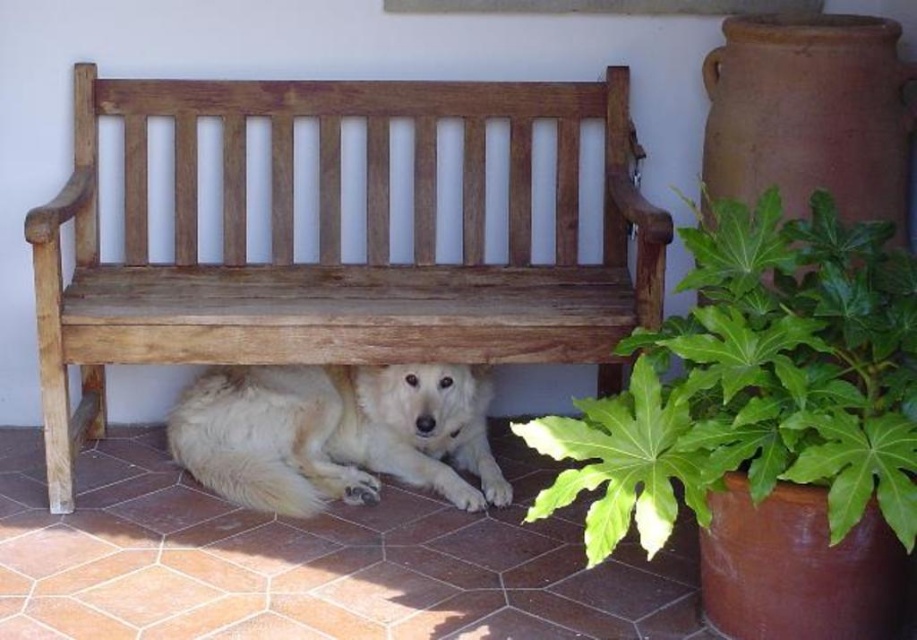
Is wooden bench at center to the right of green leafy plant at lower right from the viewer's perspective?

In fact, wooden bench at center is to the left of green leafy plant at lower right.

Is point (251, 339) farther from viewer compared to point (725, 326)?

Yes.

This screenshot has width=917, height=640. What are the coordinates of `wooden bench at center` in the screenshot? It's located at (334, 243).

Between wooden bench at center and white fluffy dog at under bench, which one has less height?

Standing shorter between the two is white fluffy dog at under bench.

How far apart are wooden bench at center and white fluffy dog at under bench?

wooden bench at center and white fluffy dog at under bench are 18.40 inches apart from each other.

The height and width of the screenshot is (640, 917). What are the coordinates of `wooden bench at center` in the screenshot? It's located at (334, 243).

Between green leafy plant at lower right and white fluffy dog at under bench, which one has less height?

Standing shorter between the two is white fluffy dog at under bench.

Who is taller, green leafy plant at lower right or white fluffy dog at under bench?

green leafy plant at lower right

Describe the element at coordinates (757, 381) in the screenshot. This screenshot has height=640, width=917. I see `green leafy plant at lower right` at that location.

The width and height of the screenshot is (917, 640). I want to click on green leafy plant at lower right, so click(x=757, y=381).